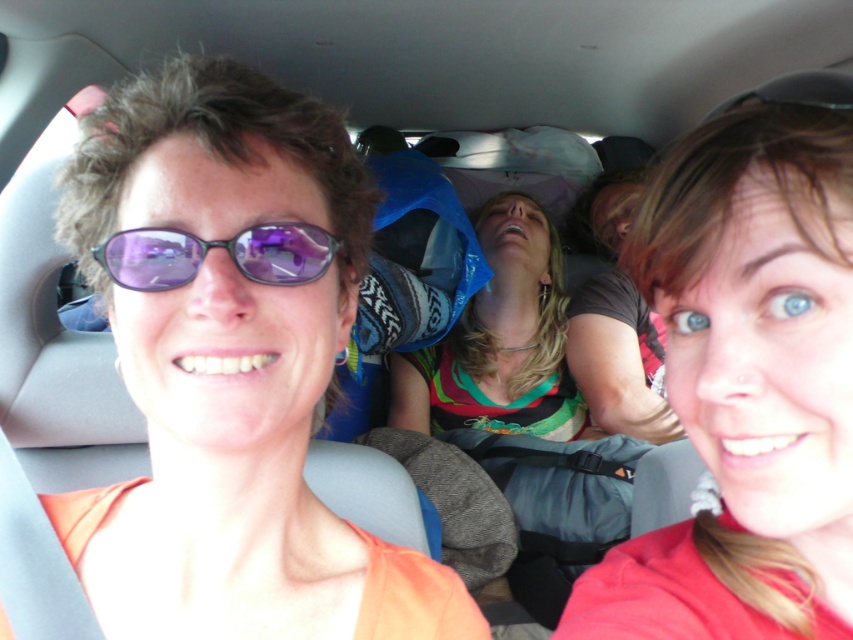
You are sitting in the front passenger seat of the car and notice two points marked in the scene. Which point, point (682, 385) or point (534, 232), is nearer to you?

Point (682, 385) is closer to the camera than point (534, 232), so the point nearer to you is point (682, 385).

You are a photographer sitting in the front passenger seat of the car. You want to take a photo of the two women in the backseat. The smooth red shirt at center and the purple reflective sunglasses at center are in your view. Which object is positioned higher in the frame?

The smooth red shirt at center is much taller than purple reflective sunglasses at center, so the smooth red shirt at center is positioned higher in the frame.

You are a passenger in the car and want to place both the multicolored jersey at center and the purple reflective sunglasses at center on the dashboard in front of you. Which object should you place first to ensure they both fit without overlapping?

The multicolored jersey at center is wider than the purple reflective sunglasses at center, so you should place the wider jersey first to accommodate its size, then the sunglasses next to it.